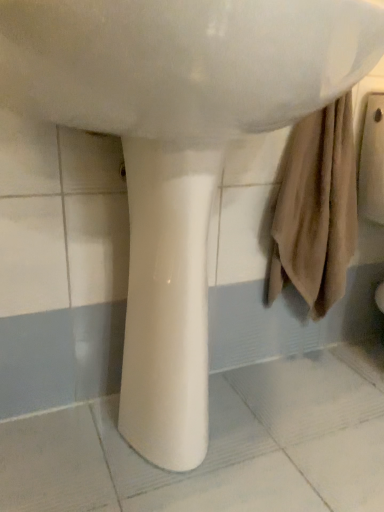
Locate an element on the screen. This screenshot has width=384, height=512. vacant space positioned to the left of white glossy pedestal at center is located at coordinates (67, 443).